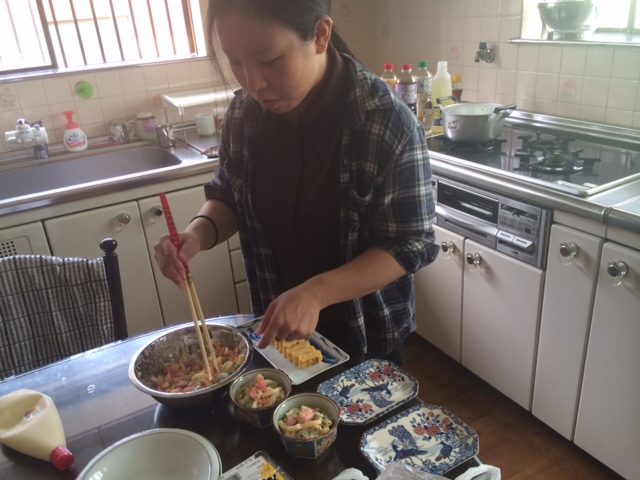
You are a GUI agent. You are given a task and a screenshot of the screen. Output one action in this format:
    pyautogui.click(x=<x>, y=<y>)
    Task: Click on the burners
    The height and width of the screenshot is (480, 640).
    Given the screenshot: What is the action you would take?
    pyautogui.click(x=559, y=167), pyautogui.click(x=540, y=137), pyautogui.click(x=483, y=147)